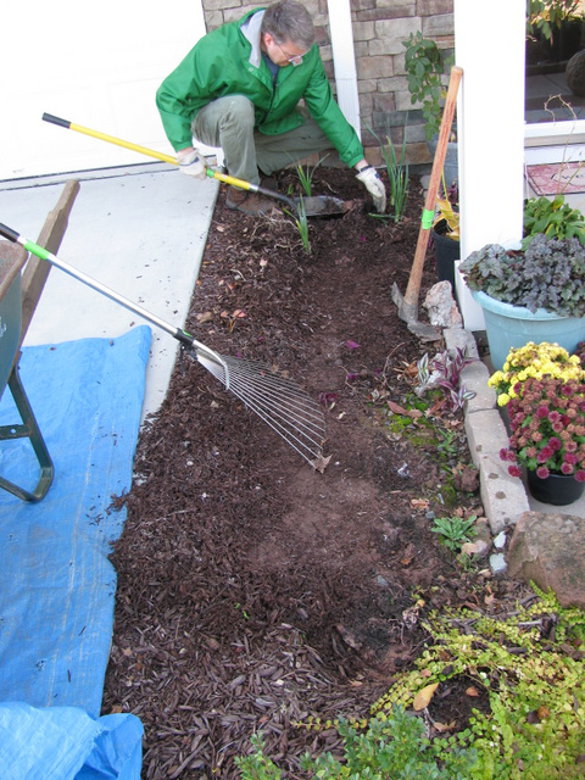
You are a GUI agent. You are given a task and a screenshot of the screen. Output one action in this format:
    pyautogui.click(x=<x>, y=<y>)
    Task: Click on the flower pot
    This screenshot has width=585, height=780.
    Given the screenshot: What is the action you would take?
    [x=560, y=488], [x=497, y=348], [x=443, y=254]